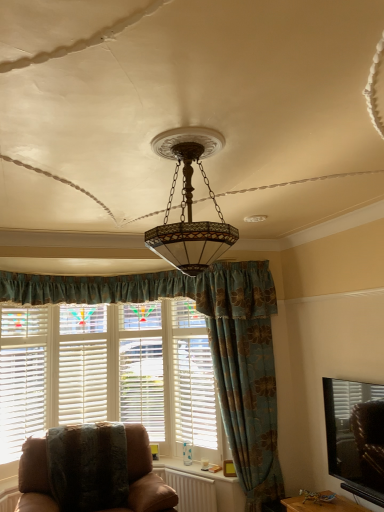
The image size is (384, 512). Describe the element at coordinates (142, 368) in the screenshot. I see `white wood shutter at center` at that location.

Find the location of `white wood window frame at center`. white wood window frame at center is located at coordinates (82, 364).

Locate an element on the screen. The height and width of the screenshot is (512, 384). white plastic radiator at lower center is located at coordinates (190, 489).

In the scene shown: In order to face white plastic radiator at lower center, should I rotate leftwards or rightwards?

A 0.364 degree turn to the right will do.

What do you see at coordinates (190, 204) in the screenshot? This screenshot has height=512, width=384. I see `matte glass chandelier at center` at bounding box center [190, 204].

In order to click on white wood shutter at center in this screenshot , I will do `click(142, 368)`.

Considering the positions of point (220, 342) and point (8, 446), is point (220, 342) closer or farther from the camera than point (8, 446)?

Clearly, point (220, 342) is closer to the camera than point (8, 446).

Can you tell me how much blue floral fabric curtain at center and white wooden blinds at left differ in facing direction?

blue floral fabric curtain at center and white wooden blinds at left are facing 36.1 degrees away from each other.

Considering the relative sizes of blue floral fabric curtain at center and white wooden blinds at left in the image provided, is blue floral fabric curtain at center thinner than white wooden blinds at left?

No.

Could you tell me if blue floral fabric curtain at center is facing white wooden blinds at left?

No, blue floral fabric curtain at center is not oriented towards white wooden blinds at left.

Does white plastic radiator at lower center come in front of white wood shutter at center?

Yes, it is.

How far apart are white plastic radiator at lower center and white wood shutter at center?

white plastic radiator at lower center is 36.52 inches from white wood shutter at center.

Considering the relative sizes of white plastic radiator at lower center and white wood shutter at center in the image provided, is white plastic radiator at lower center wider than white wood shutter at center?

No.

Considering the relative positions of white plastic radiator at lower center and white wood shutter at center in the image provided, is white plastic radiator at lower center to the right of white wood shutter at center from the viewer's perspective?

Yes, white plastic radiator at lower center is to the right of white wood shutter at center.

Does point (30, 501) come in front of point (166, 470)?

Yes, point (30, 501) is closer to viewer.

In the scene shown: Does brown leather chair at lower left have a smaller size compared to white plastic radiator at lower center?

No, brown leather chair at lower left is not smaller than white plastic radiator at lower center.

From the picture: In terms of height, does brown leather chair at lower left look taller or shorter compared to white plastic radiator at lower center?

Considering their sizes, brown leather chair at lower left has more height than white plastic radiator at lower center.

Considering the sizes of objects matte white blinds at lower right and white wood window frame at center in the image provided, who is shorter, matte white blinds at lower right or white wood window frame at center?

With less height is matte white blinds at lower right.

Could you tell me if matte white blinds at lower right is turned towards white wood window frame at center?

No, matte white blinds at lower right does not turn towards white wood window frame at center.

From the image's perspective, is matte white blinds at lower right positioned above or below white wood window frame at center?

Clearly, from the image's perspective, matte white blinds at lower right is below white wood window frame at center.

Is matte white blinds at lower right next to white wood window frame at center and touching it?

No, matte white blinds at lower right is not making contact with white wood window frame at center.

In terms of width, does blue floral fabric curtain at center look wider or thinner when compared to white plastic radiator at lower center?

Considering their sizes, blue floral fabric curtain at center looks broader than white plastic radiator at lower center.

Locate an element on the screen. Image resolution: width=384 pixels, height=512 pixels. radiator directly beneath the blue floral fabric curtain at center (from a real-world perspective) is located at coordinates (190, 489).

From the image's perspective, between white wood window frame at center and brown leather chair at lower left, which one is located above?

white wood window frame at center appears higher in the image.

Does point (78, 373) come behind point (130, 470)?

Yes, point (78, 373) is behind point (130, 470).

Identify the location of window frame positioned vertically above the brown leather chair at lower left (from a real-world perspective). The height and width of the screenshot is (512, 384). (82, 364).

Is brown leather chair at lower left at the back of white wood window frame at center?

No, white wood window frame at center is not facing the opposite direction of brown leather chair at lower left.

Measure the distance from matte white blinds at lower right to blue floral fabric curtain at center.

They are 32.31 inches apart.

Does matte white blinds at lower right have a lesser height compared to blue floral fabric curtain at center?

Yes.

In the scene shown: From the image's perspective, relative to blue floral fabric curtain at center, is matte white blinds at lower right above or below?

From the image's perspective, matte white blinds at lower right appears below blue floral fabric curtain at center.

This screenshot has height=512, width=384. I want to click on curtain on the right side of white wooden blinds at left, so click(x=245, y=370).

Where is `radiator in front of the white wood shutter at center`? Image resolution: width=384 pixels, height=512 pixels. radiator in front of the white wood shutter at center is located at coordinates (190, 489).

Looking at this image, when comparing their distances from white wood window frame at center, does white wooden blinds at left or white plastic radiator at lower center seem further?

Based on the image, white plastic radiator at lower center appears to be further to white wood window frame at center.

Based on their spatial positions, is white wooden blinds at left or matte white blinds at lower right closer to white wood shutter at center?

Based on the image, white wooden blinds at left appears to be nearer to white wood shutter at center.

When comparing their distances from white wooden blinds at left, does matte white blinds at lower right or brown leather chair at lower left seem further?

Based on the image, matte white blinds at lower right appears to be further to white wooden blinds at left.

Estimate the real-world distances between objects in this image. Which object is closer to white wooden blinds at left, white wood window frame at center or brown leather chair at lower left?

Based on the image, white wood window frame at center appears to be nearer to white wooden blinds at left.

Based on their spatial positions, is brown leather chair at lower left or blue floral fabric curtain at center further from white wood shutter at center?

blue floral fabric curtain at center lies further to white wood shutter at center than the other object.

Consider the image. Looking at the image, which one is located closer to brown leather chair at lower left, white wood window frame at center or blue floral fabric curtain at center?

The object closer to brown leather chair at lower left is blue floral fabric curtain at center.

Looking at the image, which one is located closer to white plastic radiator at lower center, white wood shutter at center or white wood window frame at center?

white wood shutter at center lies closer to white plastic radiator at lower center than the other object.

Looking at this image, estimate the real-world distances between objects in this image. Which object is further from matte glass chandelier at center, white plastic radiator at lower center or white wooden blinds at left?

white plastic radiator at lower center lies further to matte glass chandelier at center than the other object.

Where is `window frame between white wooden blinds at left and matte white blinds at lower right in the horizontal direction`? The height and width of the screenshot is (512, 384). window frame between white wooden blinds at left and matte white blinds at lower right in the horizontal direction is located at coordinates (82, 364).

Identify the location of curtain between brown leather chair at lower left and white wood shutter at center along the z-axis. The width and height of the screenshot is (384, 512). (245, 370).

Locate an element on the screen. The image size is (384, 512). blind between matte glass chandelier at center and white wood shutter at center along the z-axis is located at coordinates (22, 377).

Where is `radiator between white wooden blinds at left and blue floral fabric curtain at center`? radiator between white wooden blinds at left and blue floral fabric curtain at center is located at coordinates (190, 489).